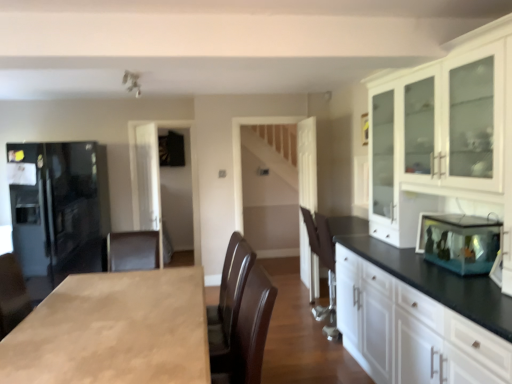
Question: Would you consider light brown wood countertop at center to be distant from transparent glass fish tank at right?

Choices:
 (A) yes
 (B) no

Answer: (A)

Question: From the image's perspective, is light brown wood countertop at center below transparent glass fish tank at right?

Choices:
 (A) no
 (B) yes

Answer: (B)

Question: From the image's perspective, is light brown wood countertop at center above transparent glass fish tank at right?

Choices:
 (A) no
 (B) yes

Answer: (A)

Question: Is light brown wood countertop at center further to the viewer compared to transparent glass fish tank at right?

Choices:
 (A) no
 (B) yes

Answer: (A)

Question: From a real-world perspective, is light brown wood countertop at center over transparent glass fish tank at right?

Choices:
 (A) yes
 (B) no

Answer: (B)

Question: Is brown leather armchair at center spatially inside transparent glass cabinet at center, or outside of it?

Choices:
 (A) outside
 (B) inside

Answer: (A)

Question: Is point (310, 223) closer or farther from the camera than point (141, 185)?

Choices:
 (A) closer
 (B) farther

Answer: (A)

Question: From a real-world perspective, is brown leather armchair at center positioned above or below transparent glass cabinet at center?

Choices:
 (A) above
 (B) below

Answer: (B)

Question: Considering the positions of brown leather armchair at center and transparent glass cabinet at center in the image, is brown leather armchair at center wider or thinner than transparent glass cabinet at center?

Choices:
 (A) thin
 (B) wide

Answer: (B)

Question: From a real-world perspective, is brown leather armchair at center positioned above or below light brown wood countertop at center?

Choices:
 (A) below
 (B) above

Answer: (B)

Question: Choose the correct answer: Is brown leather armchair at center inside light brown wood countertop at center or outside it?

Choices:
 (A) outside
 (B) inside

Answer: (A)

Question: Considering the positions of brown leather armchair at center and light brown wood countertop at center in the image, is brown leather armchair at center wider or thinner than light brown wood countertop at center?

Choices:
 (A) thin
 (B) wide

Answer: (A)

Question: Is brown leather armchair at center to the left or to the right of light brown wood countertop at center in the image?

Choices:
 (A) left
 (B) right

Answer: (B)

Question: Does point (95, 279) appear closer or farther from the camera than point (482, 228)?

Choices:
 (A) farther
 (B) closer

Answer: (A)

Question: Is light brown wood countertop at center inside the boundaries of transparent glass fish tank at right, or outside?

Choices:
 (A) outside
 (B) inside

Answer: (A)